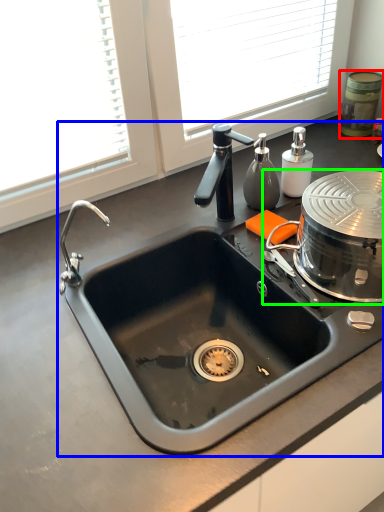
Question: Considering the real-world distances, which object is farthest from appliance (highlighted by a red box)? sink (highlighted by a blue box) or appliance (highlighted by a green box)?

Choices:
 (A) sink
 (B) appliance

Answer: (A)